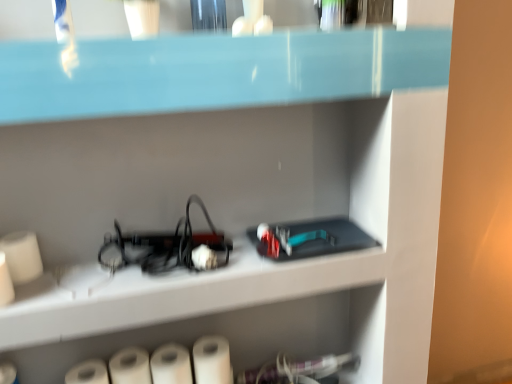
Question: Is white matte paper towel at lower left, which is the 1th paper towel in left-to-right order, positioned behind white matte paper towel at lower center, marked as the 4th paper towel in a left-to-right arrangement?

Choices:
 (A) yes
 (B) no

Answer: (B)

Question: From a real-world perspective, is white matte paper towel at lower left, which is the 1th paper towel in left-to-right order, beneath white matte paper towel at lower center, which is the 1th paper towel in right-to-left order?

Choices:
 (A) yes
 (B) no

Answer: (A)

Question: From a real-world perspective, is white matte paper towel at lower left, the fourth paper towel positioned from the right, physically above white matte paper towel at lower center, marked as the 4th paper towel in a left-to-right arrangement?

Choices:
 (A) no
 (B) yes

Answer: (A)

Question: Is white matte paper towel at lower left, which is the 1th paper towel in left-to-right order, at the left side of white matte paper towel at lower center, marked as the 4th paper towel in a left-to-right arrangement?

Choices:
 (A) yes
 (B) no

Answer: (A)

Question: Is white matte paper towel at lower left, the fourth paper towel positioned from the right, positioned before white matte paper towel at lower center, marked as the 4th paper towel in a left-to-right arrangement?

Choices:
 (A) yes
 (B) no

Answer: (A)

Question: In the image, is white matte paper towel at lower center, which is the 1th paper towel in right-to-left order, on the left side or the right side of white matte paper towel at lower left, the fourth paper towel positioned from the right?

Choices:
 (A) right
 (B) left

Answer: (A)

Question: From a real-world perspective, relative to white matte paper towel at lower left, which is the 1th paper towel in left-to-right order, is white matte paper towel at lower center, which is the 1th paper towel in right-to-left order, vertically above or below?

Choices:
 (A) below
 (B) above

Answer: (B)

Question: Looking at the image, does white matte paper towel at lower center, which is the 1th paper towel in right-to-left order, seem bigger or smaller compared to white matte paper towel at lower left, the fourth paper towel positioned from the right?

Choices:
 (A) big
 (B) small

Answer: (B)

Question: Relative to white matte paper towel at lower left, the fourth paper towel positioned from the right, is white matte paper towel at lower center, which is the 1th paper towel in right-to-left order, in front or behind?

Choices:
 (A) front
 (B) behind

Answer: (B)

Question: From the image's perspective, is white matte paper towel at lower center, acting as the 3th paper towel starting from the left, above or below white matte paper towel at lower center, marked as the 4th paper towel in a left-to-right arrangement?

Choices:
 (A) below
 (B) above

Answer: (A)

Question: From a real-world perspective, is white matte paper towel at lower center, the 2th paper towel positioned from the right, positioned above or below white matte paper towel at lower center, which is the 1th paper towel in right-to-left order?

Choices:
 (A) below
 (B) above

Answer: (A)

Question: Looking at their shapes, would you say white matte paper towel at lower center, the 2th paper towel positioned from the right, is wider or thinner than white matte paper towel at lower center, which is the 1th paper towel in right-to-left order?

Choices:
 (A) thin
 (B) wide

Answer: (B)

Question: In the image, is white matte paper towel at lower center, acting as the 3th paper towel starting from the left, on the left side or the right side of white matte paper towel at lower center, marked as the 4th paper towel in a left-to-right arrangement?

Choices:
 (A) right
 (B) left

Answer: (B)

Question: In the image, is white matte paper towel at lower center, marked as the 4th paper towel in a left-to-right arrangement, positioned in front of or behind white matte paper towel at lower center, acting as the 3th paper towel starting from the left?

Choices:
 (A) behind
 (B) front

Answer: (A)

Question: Considering the relative positions of white matte paper towel at lower center, which is the 1th paper towel in right-to-left order, and white matte paper towel at lower center, acting as the 3th paper towel starting from the left, in the image provided, is white matte paper towel at lower center, which is the 1th paper towel in right-to-left order, to the left or to the right of white matte paper towel at lower center, acting as the 3th paper towel starting from the left,?

Choices:
 (A) right
 (B) left

Answer: (A)